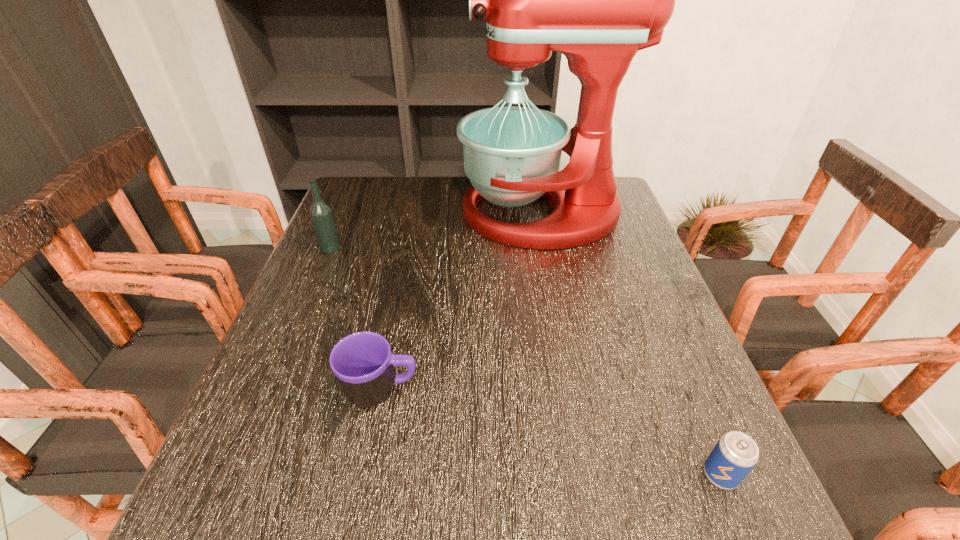
I want to click on vacant region located on the back of the second tallest object, so click(353, 193).

What are the coordinates of `free space located 0.090m with the handle on the side of the mug` in the screenshot? It's located at (468, 391).

You are a GUI agent. You are given a task and a screenshot of the screen. Output one action in this format:
    pyautogui.click(x=<x>, y=<y>)
    Task: Click on the free space located on the left of the beer can
    
    Given the screenshot: What is the action you would take?
    pyautogui.click(x=477, y=475)

Where is `object at the far edge`? This screenshot has width=960, height=540. object at the far edge is located at coordinates (598, 0).

Find the location of `object situated at the near edge`. object situated at the near edge is located at coordinates (735, 454).

Find the location of `object at the left edge`. object at the left edge is located at coordinates (321, 213).

In order to click on mixer that is positioned at the right edge in this screenshot , I will do `click(598, 0)`.

Locate an element on the screen. Image resolution: width=960 pixels, height=540 pixels. beer can present at the right edge is located at coordinates (735, 454).

Locate an element on the screen. The image size is (960, 540). object that is at the far right corner is located at coordinates point(598,0).

Where is `object located in the near right corner section of the desktop`? The height and width of the screenshot is (540, 960). object located in the near right corner section of the desktop is located at coordinates (735, 454).